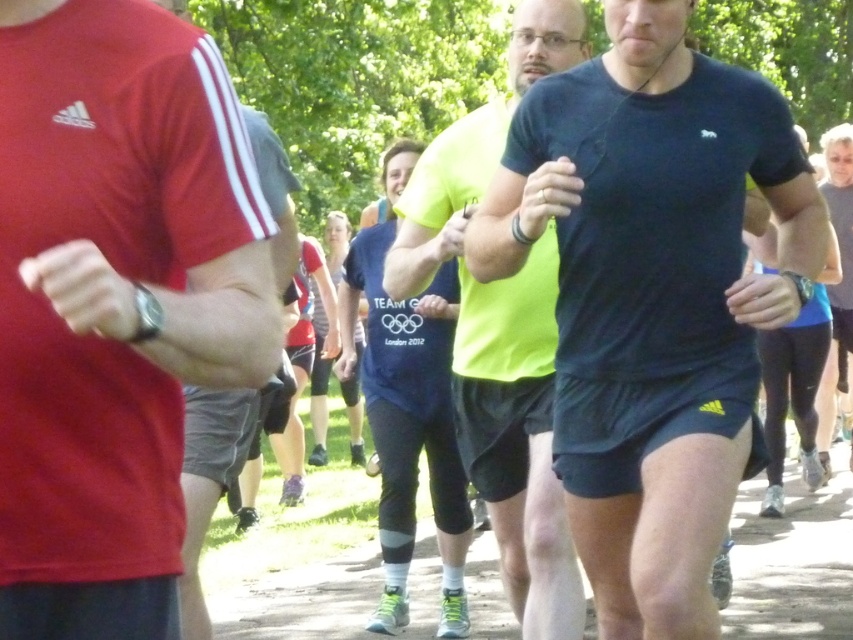
Which is behind, point (759, 282) or point (822, 452)?

The point (822, 452) is more distant.

Is dark blue t-shirt at center above blue fabric shorts at center?

No, dark blue t-shirt at center is not above blue fabric shorts at center.

Between point (751, 301) and point (828, 472), which one is positioned behind?

Point (828, 472)

Locate an element on the screen. Image resolution: width=853 pixels, height=640 pixels. dark blue t-shirt at center is located at coordinates (653, 298).

Between point (134, 136) and point (845, 225), which one is positioned behind?

Positioned behind is point (845, 225).

Which is behind, point (151, 552) or point (843, 172)?

Point (843, 172)

Identify the location of matte red t-shirt at left. This screenshot has width=853, height=640. (114, 304).

Is point (701, 97) positioned before point (486, 401)?

Yes, point (701, 97) is in front of point (486, 401).

Who is more distant from viewer, [724,284] or [448,232]?

The point [448,232] is more distant.

Is point (634, 634) positioned behind point (535, 285)?

That is False.

The height and width of the screenshot is (640, 853). I want to click on dark blue t-shirt at center, so click(x=653, y=298).